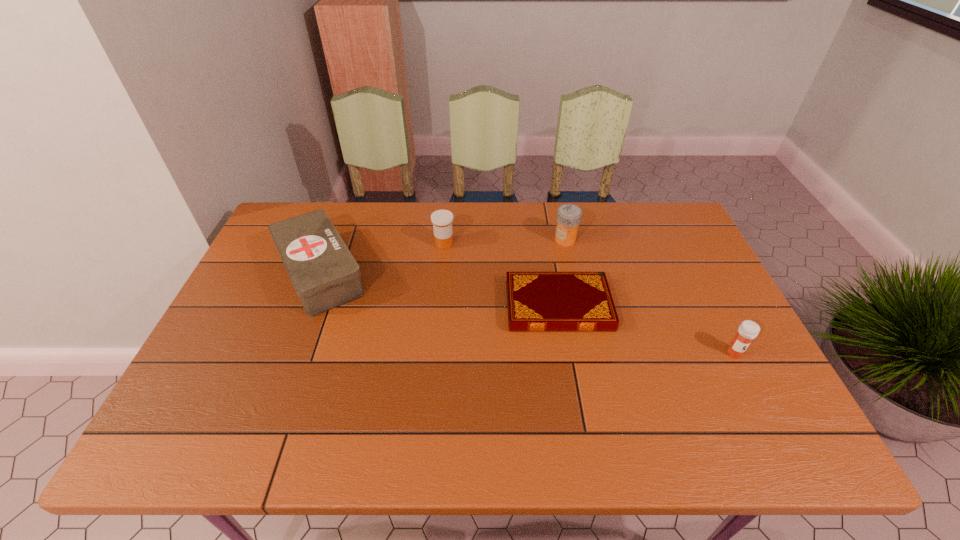
I want to click on vacant space at the near edge of the desktop, so click(x=549, y=435).

At what (x,y) coordinates should I click in order to perform the action: click on free region at the left edge. Please return your answer as a coordinate pair (x, y). Image resolution: width=960 pixels, height=540 pixels. Looking at the image, I should click on (259, 368).

You are a GUI agent. You are given a task and a screenshot of the screen. Output one action in this format:
    pyautogui.click(x=<x>, y=<y>)
    Task: Click on the free spot at the right edge of the desktop
    The width and height of the screenshot is (960, 540).
    Given the screenshot: What is the action you would take?
    pyautogui.click(x=689, y=301)

I want to click on vacant space at the far right corner, so click(x=637, y=204).

This screenshot has height=540, width=960. In the image, there is a desktop. In order to click on vacant space at the near right corner in this screenshot , I will do `click(728, 430)`.

Where is `unoccupied position between the first-aid kit and the hardback book`? unoccupied position between the first-aid kit and the hardback book is located at coordinates (440, 289).

At what (x,y) coordinates should I click in order to perform the action: click on free area in between the second medicine from right to left and the second object from left to right. Please return your answer as a coordinate pair (x, y). The height and width of the screenshot is (540, 960). Looking at the image, I should click on (505, 242).

At what (x,y) coordinates should I click in order to perform the action: click on free point between the leftmost object and the fourth object from right to left. Please return your answer as a coordinate pair (x, y). The width and height of the screenshot is (960, 540). Looking at the image, I should click on (382, 258).

Identify the location of free spot between the leftmost medicine and the first-aid kit. The image size is (960, 540). (382, 258).

Identify the location of vacant region between the second medicine from right to left and the first-aid kit. [443, 256].